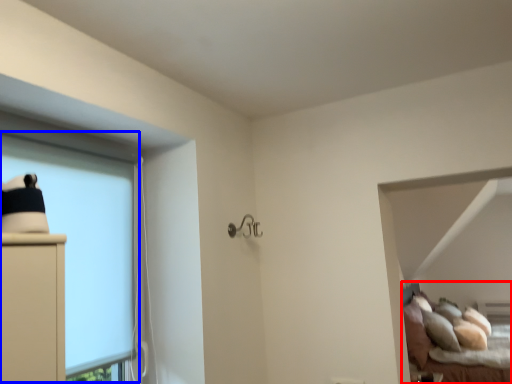
Question: Which point is further to the camera, bed (highlighted by a red box) or bay window (highlighted by a blue box)?

Choices:
 (A) bed
 (B) bay window

Answer: (A)